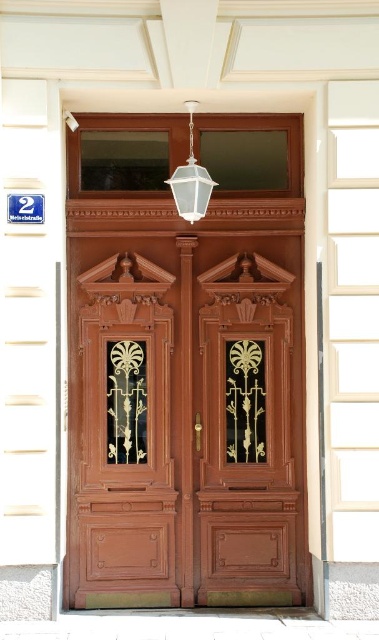
Does matte wood door at center appear over clear glass lantern at upper center?

No, matte wood door at center is not above clear glass lantern at upper center.

Find the location of `matte wood door at center`. matte wood door at center is located at coordinates (186, 365).

Is polished wood door at center smaller than clear glass lantern at upper center?

Incorrect, polished wood door at center is not smaller in size than clear glass lantern at upper center.

Image resolution: width=379 pixels, height=640 pixels. I want to click on polished wood door at center, so click(x=125, y=449).

Is point (151, 580) positioned behind point (173, 172)?

That is False.

I want to click on polished wood door at center, so click(x=125, y=449).

Which is in front, point (191, 140) or point (142, 502)?

Point (142, 502)

Is matte wood door at center wider than polished wood door at center?

Indeed, matte wood door at center has a greater width compared to polished wood door at center.

Who is more distant from viewer, (242,580) or (81,486)?

Positioned behind is point (242,580).

This screenshot has height=640, width=379. Find the location of `matte wood door at center`. matte wood door at center is located at coordinates (186, 365).